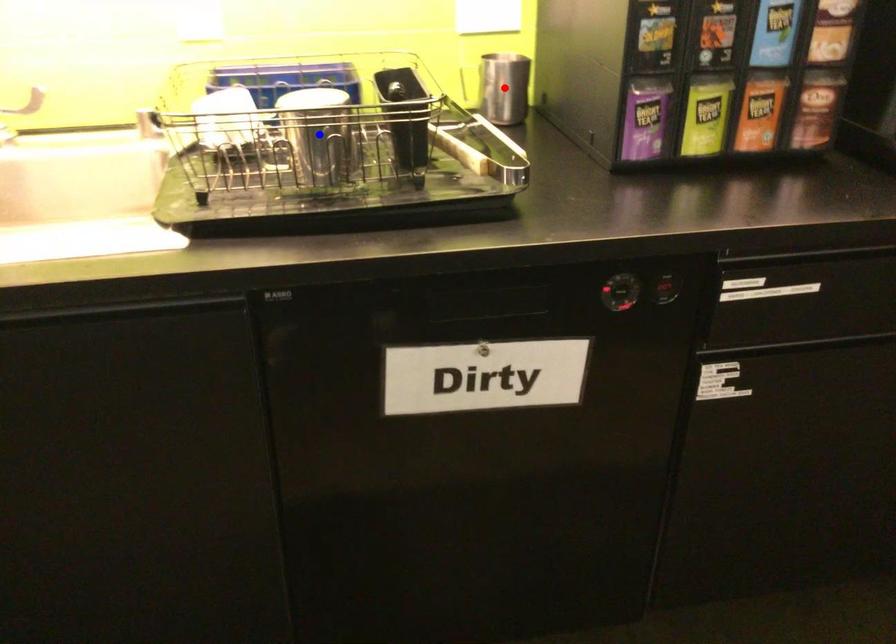
Question: In the image, two points are highlighted. Which point is nearer to the camera? Reply with the corresponding letter.

Choices:
 (A) blue point
 (B) red point

Answer: (A)